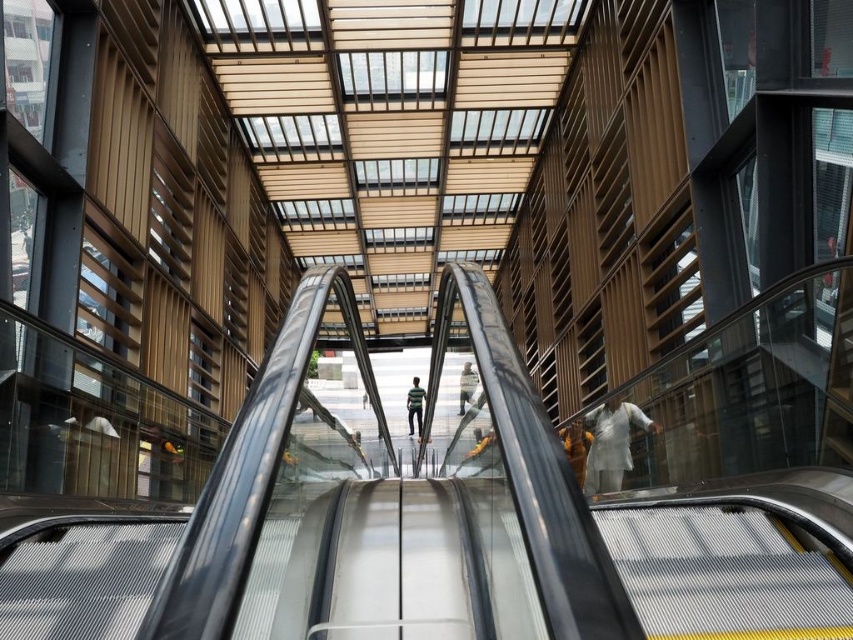
Question: Which point is farther to the camera?

Choices:
 (A) light brown leather jacket at center
 (B) brown leather jacket at center
 (C) striped shirt at center

Answer: (C)

Question: Can you confirm if white cloth at right is positioned below light brown leather jacket at center?

Choices:
 (A) yes
 (B) no

Answer: (A)

Question: Is brown leather jacket at center positioned in front of light brown leather jacket at center?

Choices:
 (A) yes
 (B) no

Answer: (B)

Question: Which of these objects is positioned farthest from the white cloth at right?

Choices:
 (A) light brown leather jacket at center
 (B) brown leather jacket at center

Answer: (A)

Question: Which point is closer to the camera?

Choices:
 (A) striped shirt at center
 (B) brown leather jacket at center
 (C) white cloth at right

Answer: (C)

Question: Does striped shirt at center appear under light brown leather jacket at center?

Choices:
 (A) no
 (B) yes

Answer: (B)